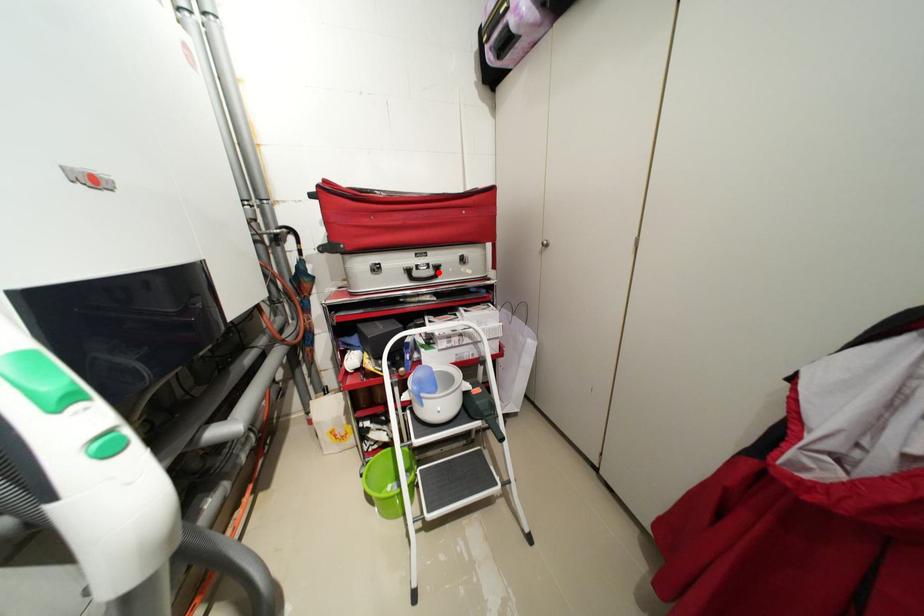
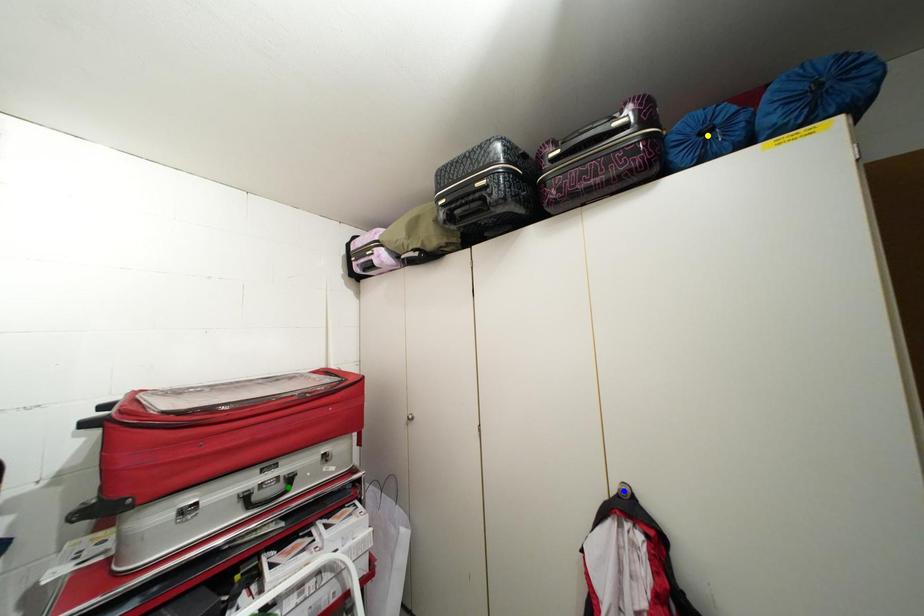
Question: I am providing you with two images of the same scene from different viewpoints. A red point is marked on the first image. You are given multiple points on the second image. Which mark in image 2 goes with the point in image 1?

Choices:
 (A) yellow point
 (B) blue point
 (C) green point

Answer: (C)